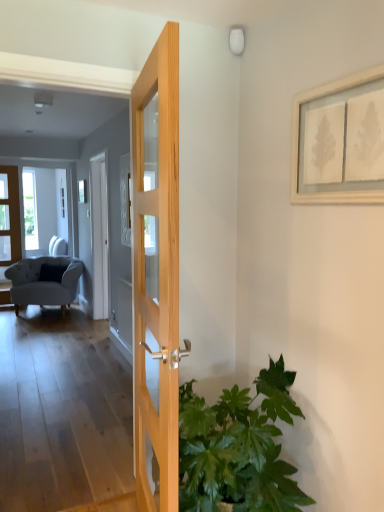
Measure the distance between white wooden picture frame at upper right and camera.

The distance of white wooden picture frame at upper right from camera is 1.35 meters.

Image resolution: width=384 pixels, height=512 pixels. What do you see at coordinates (339, 141) in the screenshot? I see `white wooden picture frame at upper right` at bounding box center [339, 141].

What is the approximate width of green leafy plant at lower right?

The width of green leafy plant at lower right is 60.62 centimeters.

What is the approximate height of matte wooden door at left, the first door in the left-to-right sequence?

The height of matte wooden door at left, the first door in the left-to-right sequence, is 6.73 feet.

In order to face light gray fabric armchair at left, should I rotate leftwards or rightwards?

You should rotate left by 18.584 degrees.

Where is `white wooden picture frame at upper right`? This screenshot has width=384, height=512. white wooden picture frame at upper right is located at coordinates (339, 141).

From the image's perspective, which object appears higher, white wooden picture frame at upper right or natural wood door at center, arranged as the 2th door when viewed from the left?

white wooden picture frame at upper right is shown above in the image.

Can you tell me how much white wooden picture frame at upper right and natural wood door at center, acting as the 1th door starting from the front, differ in facing direction?

They differ by 9.28 degrees in their facing directions.

Between white wooden picture frame at upper right and natural wood door at center, marked as the second door in a back-to-front arrangement, which one is positioned in front?

Positioned in front is natural wood door at center, marked as the second door in a back-to-front arrangement.

From a real-world perspective, who is located higher, white wooden picture frame at upper right or natural wood door at center, acting as the 1th door starting from the front?

white wooden picture frame at upper right, from a real-world perspective.

Can you tell me how much natural wood door at center, acting as the 1th door starting from the front, and white wooden picture frame at upper right differ in facing direction?

The facing directions of natural wood door at center, acting as the 1th door starting from the front, and white wooden picture frame at upper right are 9.28 degrees apart.

Is the surface of natural wood door at center, acting as the 1th door starting from the front, in direct contact with white wooden picture frame at upper right?

No, natural wood door at center, acting as the 1th door starting from the front, is not next to white wooden picture frame at upper right.

Does natural wood door at center, marked as the second door in a back-to-front arrangement, have a smaller size compared to white wooden picture frame at upper right?

Incorrect, natural wood door at center, marked as the second door in a back-to-front arrangement, is not smaller in size than white wooden picture frame at upper right.

Is natural wood door at center, acting as the 1th door starting from the front, facing away from white wooden picture frame at upper right?

Yes, natural wood door at center, acting as the 1th door starting from the front,'s orientation is away from white wooden picture frame at upper right.

Is natural wood door at center, the first door when ordered from right to left, taller or shorter than light gray fabric armchair at left?

Considering their sizes, natural wood door at center, the first door when ordered from right to left, has more height than light gray fabric armchair at left.

In the scene shown: Which is closer to the camera, (163, 318) or (77, 263)?

The point (163, 318) is closer to the camera.

Measure the distance between natural wood door at center, the first door when ordered from right to left, and light gray fabric armchair at left.

They are 3.60 meters apart.

Does green leafy plant at lower right turn towards natural wood door at center, acting as the 1th door starting from the front?

Yes.

Would you say green leafy plant at lower right contains natural wood door at center, the first door when ordered from right to left?

Definitely not — natural wood door at center, the first door when ordered from right to left, is not inside green leafy plant at lower right.

Is the surface of green leafy plant at lower right in direct contact with natural wood door at center, the first door when ordered from right to left?

No, green leafy plant at lower right is not making contact with natural wood door at center, the first door when ordered from right to left.

Is green leafy plant at lower right in front of light gray fabric armchair at left?

Yes, it is in front of light gray fabric armchair at left.

Can we say green leafy plant at lower right lies outside light gray fabric armchair at left?

Yes, green leafy plant at lower right is located beyond the bounds of light gray fabric armchair at left.

Considering the positions of objects green leafy plant at lower right and light gray fabric armchair at left in the image provided, who is more to the left, green leafy plant at lower right or light gray fabric armchair at left?

Positioned to the left is light gray fabric armchair at left.

Is green leafy plant at lower right wider or thinner than light gray fabric armchair at left?

Clearly, green leafy plant at lower right has less width compared to light gray fabric armchair at left.

Is matte wooden door at left, which is the second door in front-to-back order, in front of white wooden picture frame at upper right?

No, the depth of matte wooden door at left, which is the second door in front-to-back order, is greater than that of white wooden picture frame at upper right.

In order to click on picture frame in front of the matte wooden door at left, which is the second door in right-to-left order in this screenshot , I will do `click(339, 141)`.

From the picture: Is matte wooden door at left, which is the second door in right-to-left order, positioned beyond the bounds of white wooden picture frame at upper right?

Absolutely, matte wooden door at left, which is the second door in right-to-left order, is external to white wooden picture frame at upper right.

Consider the image. From the image's perspective, is white wooden picture frame at upper right positioned above or below light gray fabric armchair at left?

From the image's perspective, white wooden picture frame at upper right appears above light gray fabric armchair at left.

Does white wooden picture frame at upper right turn towards light gray fabric armchair at left?

No.

You are a GUI agent. You are given a task and a screenshot of the screen. Output one action in this format:
    pyautogui.click(x=<x>, y=<y>)
    Task: Click on the picture frame above the light gray fabric armchair at left (from a real-world perspective)
    This screenshot has width=384, height=512.
    Given the screenshot: What is the action you would take?
    pyautogui.click(x=339, y=141)

Consider the image. Is white wooden picture frame at upper right not close to light gray fabric armchair at left?

Yes.

You are a GUI agent. You are given a task and a screenshot of the screen. Output one action in this format:
    pyautogui.click(x=<x>, y=<y>)
    Task: Click on the picture frame above the natural wood door at center, the first door when ordered from right to left (from the image's perspective)
    This screenshot has width=384, height=512.
    Given the screenshot: What is the action you would take?
    (339, 141)

From the image's perspective, starting from the white wooden picture frame at upper right, which door is the 2nd one below? Please provide its 2D coordinates.

[(157, 267)]

From the image, which object appears to be nearer to natural wood door at center, marked as the second door in a back-to-front arrangement, matte wooden door at left, which is the second door in right-to-left order, or light gray fabric armchair at left?

light gray fabric armchair at left is positioned closer to the anchor natural wood door at center, marked as the second door in a back-to-front arrangement.

Estimate the real-world distances between objects in this image. Which object is further from white wooden picture frame at upper right, matte wooden door at left, the first door in the left-to-right sequence, or light gray fabric armchair at left?

matte wooden door at left, the first door in the left-to-right sequence, is positioned further to the anchor white wooden picture frame at upper right.

Based on their spatial positions, is light gray fabric armchair at left or natural wood door at center, arranged as the 2th door when viewed from the left, further from green leafy plant at lower right?

The object further to green leafy plant at lower right is light gray fabric armchair at left.

When comparing their distances from natural wood door at center, arranged as the 2th door when viewed from the left, does green leafy plant at lower right or matte wooden door at left, which is the second door in front-to-back order, seem closer?

Among the two, green leafy plant at lower right is located nearer to natural wood door at center, arranged as the 2th door when viewed from the left.

Consider the image. When comparing their distances from white wooden picture frame at upper right, does matte wooden door at left, which is the second door in front-to-back order, or green leafy plant at lower right seem further?

matte wooden door at left, which is the second door in front-to-back order, lies further to white wooden picture frame at upper right than the other object.

When comparing their distances from white wooden picture frame at upper right, does light gray fabric armchair at left or natural wood door at center, acting as the 1th door starting from the front, seem closer?

natural wood door at center, acting as the 1th door starting from the front.

Looking at the image, which one is located closer to light gray fabric armchair at left, matte wooden door at left, which is the second door in right-to-left order, or white wooden picture frame at upper right?

matte wooden door at left, which is the second door in right-to-left order, is closer to light gray fabric armchair at left.

From the image, which object appears to be farther from white wooden picture frame at upper right, green leafy plant at lower right or matte wooden door at left, which is the second door in right-to-left order?

matte wooden door at left, which is the second door in right-to-left order, lies further to white wooden picture frame at upper right than the other object.

Find the location of a particular element. This screenshot has height=512, width=384. picture frame located between green leafy plant at lower right and matte wooden door at left, the first door in the left-to-right sequence, in the depth direction is located at coordinates (339, 141).

Locate an element on the screen. The width and height of the screenshot is (384, 512). chair between green leafy plant at lower right and matte wooden door at left, which is the second door in front-to-back order, along the z-axis is located at coordinates (43, 282).

Locate an element on the screen. houseplant positioned between natural wood door at center, the first door when ordered from right to left, and light gray fabric armchair at left from near to far is located at coordinates (238, 448).

You are a GUI agent. You are given a task and a screenshot of the screen. Output one action in this format:
    pyautogui.click(x=<x>, y=<y>)
    Task: Click on the chair located between natural wood door at center, acting as the 1th door starting from the front, and matte wooden door at left, which is the second door in front-to-back order, in the depth direction
    The width and height of the screenshot is (384, 512).
    Given the screenshot: What is the action you would take?
    pyautogui.click(x=43, y=282)